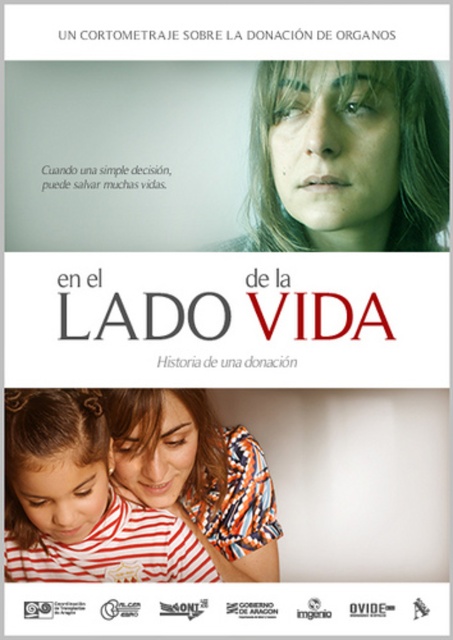
You are an assistant helping someone choose between two striped cotton shirts for a film set. The shirts are the striped cotton shirt at lower left and the striped cotton shirt at center. Which shirt is shorter in height?

The striped cotton shirt at lower left has a lesser height compared to the striped cotton shirt at center, so the striped cotton shirt at lower left is shorter in height.

You are a costume designer reviewing the promotional poster for the film. You need to ensure that the striped cotton shirt at lower left and the striped cotton shirt at center are sized appropriately for their respective actors. Based on the poster, which shirt has a larger width?

The striped cotton shirt at lower left has a larger width than the striped cotton shirt at center, so the shirt at lower left is the larger one.

You are an artist analyzing the composition of the poster. You notice two points marked on the poster. Which of the two points, point (11, 460) or point (135, 492), is closer to the viewer?

Point (11, 460) is closer to the camera than point (135, 492).